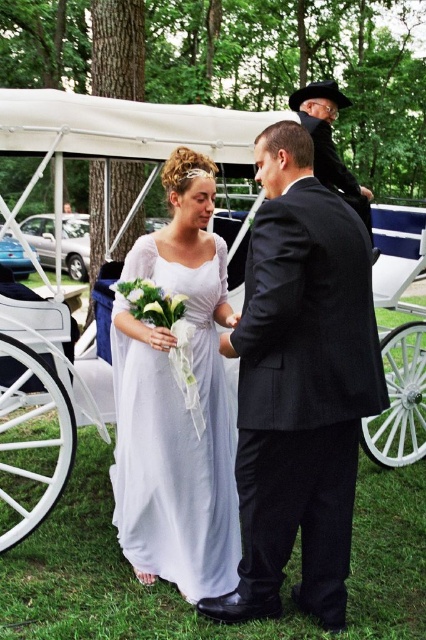
Question: Among these objects, which one is nearest to the camera?

Choices:
 (A) black leather coach at upper center
 (B) white wood horse cart at center
 (C) white chiffon dress at center

Answer: (C)

Question: Is white wood horse cart at center to the right of black leather coach at upper center from the viewer's perspective?

Choices:
 (A) no
 (B) yes

Answer: (A)

Question: Is the position of white fabric coach at center less distant than that of white chiffon dress at center?

Choices:
 (A) no
 (B) yes

Answer: (B)

Question: Estimate the real-world distances between objects in this image. Which object is closer to the white chiffon dress at center?

Choices:
 (A) black leather coach at upper center
 (B) white wood horse cart at center

Answer: (B)

Question: Is white wood horse cart at center positioned in front of white chiffon dress at center?

Choices:
 (A) no
 (B) yes

Answer: (A)

Question: Which point is closer to the camera taking this photo?

Choices:
 (A) (302, 124)
 (B) (118, 342)
 (C) (270, 572)
 (D) (391, 282)

Answer: (C)